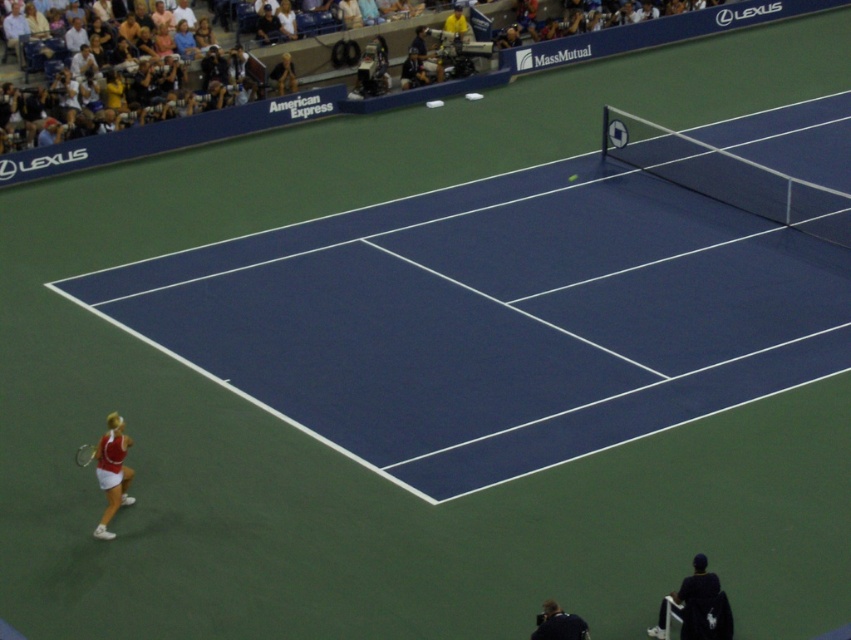
Question: Which of the following is the closest to the observer?

Choices:
 (A) green rubber tennis ball at center
 (B) dark blue jacket at lower right
 (C) white fabric tennis outfit at lower left

Answer: (B)

Question: Which object appears farthest from the camera in this image?

Choices:
 (A) metallic silver tennis racket at lower left
 (B) dark blue jacket at lower right
 (C) green rubber tennis ball at center

Answer: (C)

Question: Observing the image, what is the correct spatial positioning of white fabric tennis outfit at lower left in reference to green rubber tennis ball at center?

Choices:
 (A) left
 (B) right

Answer: (A)

Question: Is dark blue jacket at lower right below metallic silver tennis racket at lower left?

Choices:
 (A) yes
 (B) no

Answer: (A)

Question: Which point is farther to the camera?

Choices:
 (A) (572, 180)
 (B) (92, 449)
 (C) (574, 620)

Answer: (A)

Question: Is white fabric tennis outfit at lower left in front of dark blue jacket at lower right?

Choices:
 (A) yes
 (B) no

Answer: (B)